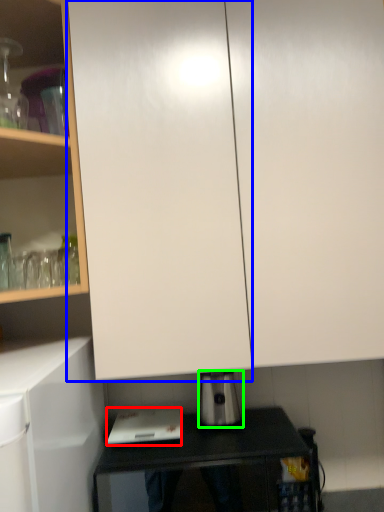
Question: Considering the real-world distances, which object is farthest from home appliance (highlighted by a red box)? glass door (highlighted by a blue box) or kitchen appliance (highlighted by a green box)?

Choices:
 (A) glass door
 (B) kitchen appliance

Answer: (A)